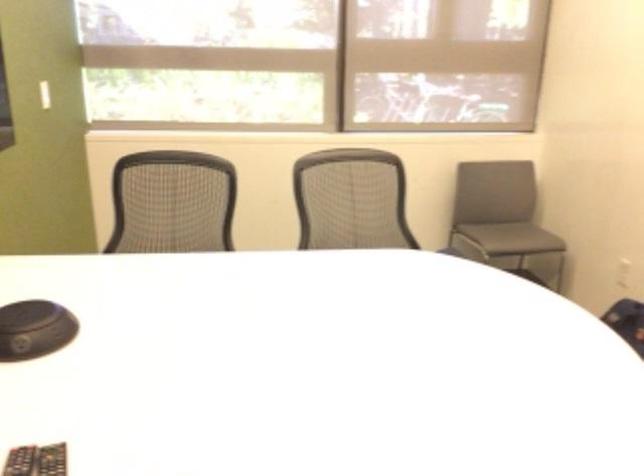
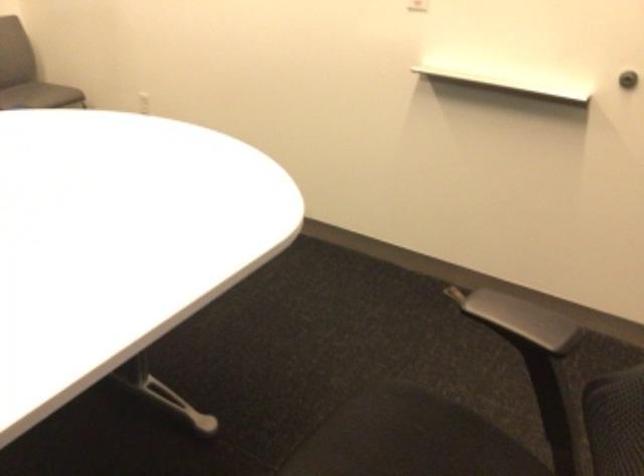
Find the pixel in the second image that matches (515,241) in the first image.

(39, 95)